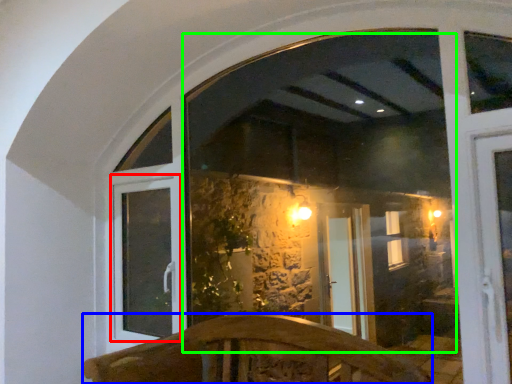
Question: Considering the real-world distances, which object is closest to window frame (highlighted by a red box)? furniture (highlighted by a blue box) or window screen (highlighted by a green box).

Choices:
 (A) furniture
 (B) window screen

Answer: (A)